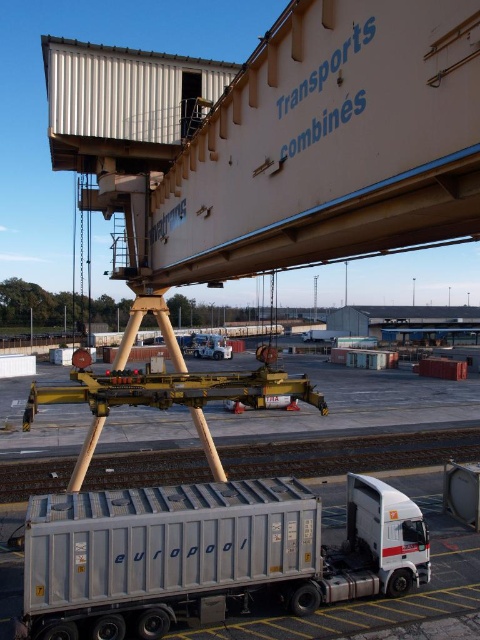
You are a traffic controller at the port and need to direct a delivery truck to the loading zone. There are two silver trucks present. The silver metallic trailer truck at lower center and the metallic silver truck at center. Which truck is positioned to the right side of the other?

The silver metallic trailer truck at lower center is to the right of the metallic silver truck at center, so the silver metallic trailer truck at lower center is positioned to the right side of the metallic silver truck at center.

Consider the image. You are a logistics planner trying to fit two trucks into a narrow alleyway. The alley is only wide enough for a truck that is 2.5 meters wide. You have the silver metallic trailer truck at lower center and the metallic silver truck at center. Which truck can safely pass through the alley without causing damage?

The silver metallic trailer truck at lower center has a lesser width compared to the metallic silver truck at center, so it can safely pass through the 2.5 meter wide alley without causing damage.